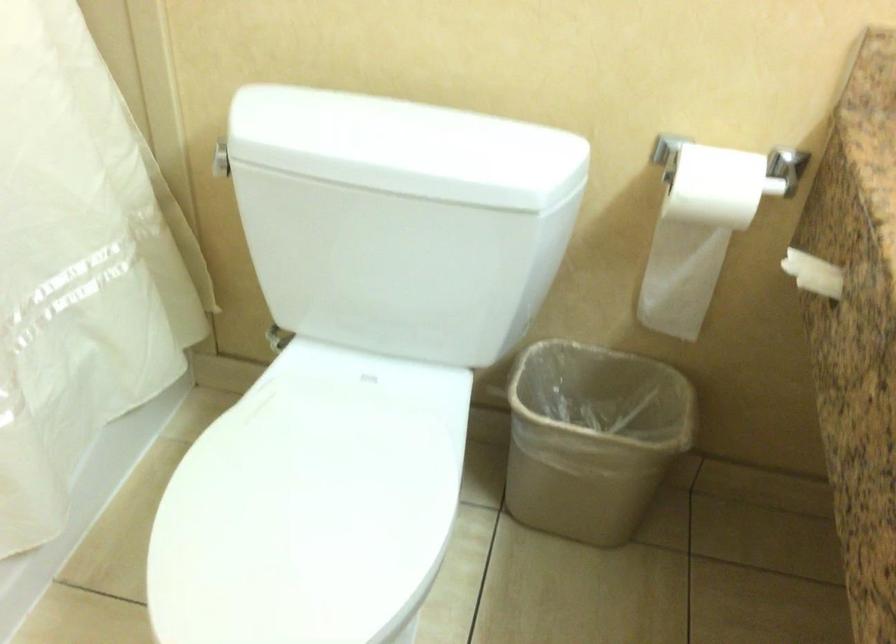
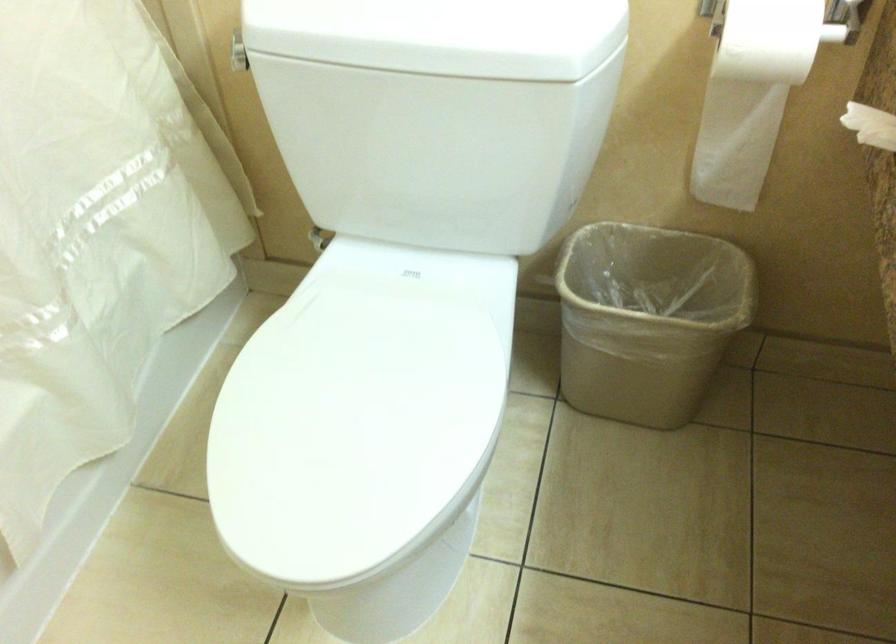
Find the pixel in the second image that matches (x=375, y=155) in the first image.

(393, 35)